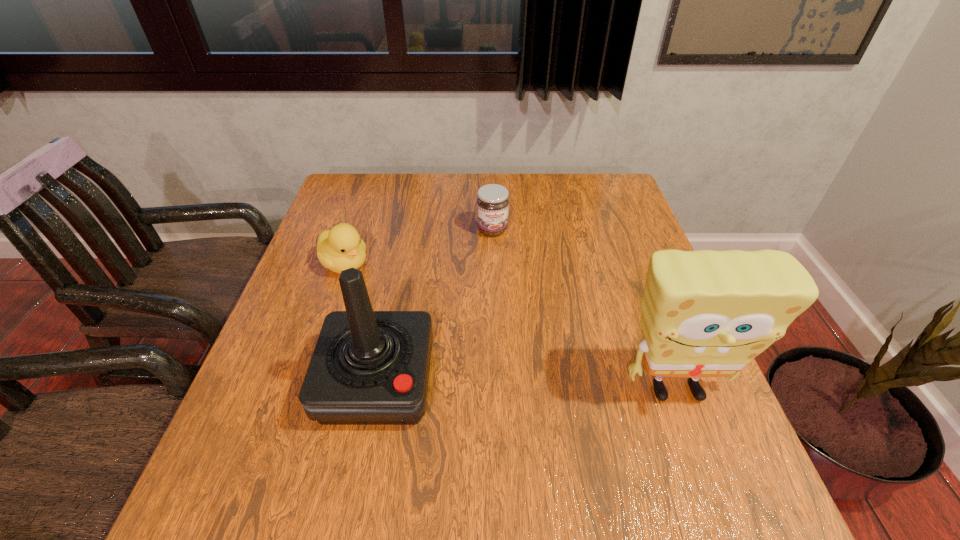
Where is `blank region between the second farthest object and the jam`? blank region between the second farthest object and the jam is located at coordinates (419, 247).

Identify the location of unoccupied area between the rightmost object and the farthest object. (584, 310).

Identify the location of vacant point located between the duck and the second object from right to left. The image size is (960, 540). (419, 247).

This screenshot has width=960, height=540. Find the location of `unoccupied position between the rightmost object and the jam`. unoccupied position between the rightmost object and the jam is located at coordinates (584, 310).

Where is `free space between the second farthest object and the sponge`? The image size is (960, 540). free space between the second farthest object and the sponge is located at coordinates (511, 327).

The width and height of the screenshot is (960, 540). In order to click on object that is the second closest one to the third object from left to right in this screenshot , I will do `click(368, 367)`.

Identify the location of object that is the second closest to the duck. pyautogui.click(x=492, y=202).